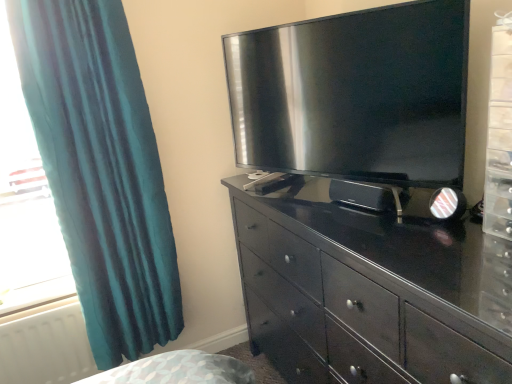
Locate an element on the screen. free point in front of black glossy television at upper center is located at coordinates (382, 244).